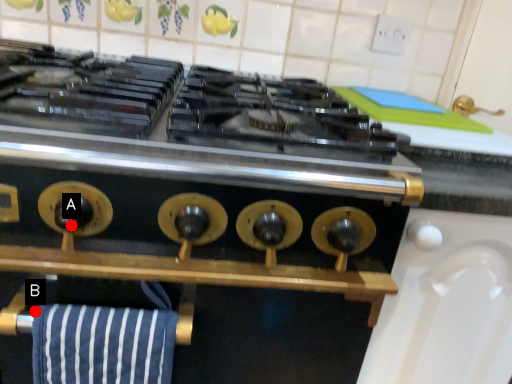
Question: Two points are circled on the image, labeled by A and B beside each circle. Which of the following is the closest to the observer?

Choices:
 (A) A is closer
 (B) B is closer

Answer: (B)